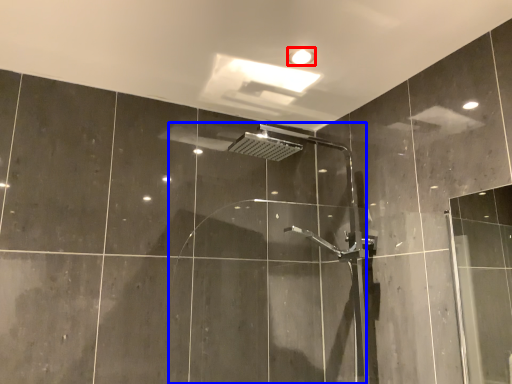
Question: Which object is closer to the camera taking this photo, light fixture (highlighted by a red box) or screen door (highlighted by a blue box)?

Choices:
 (A) light fixture
 (B) screen door

Answer: (B)